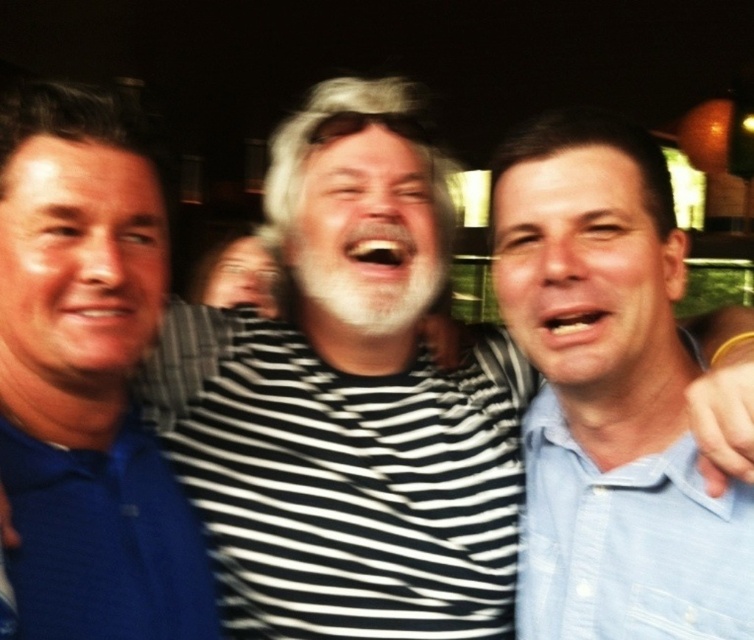
You are a photographer trying to adjust the lighting for a group photo. You notice two people wearing light blue shirts in the scene. The person in the light blue shirt at center is standing closer to the light source than the person in the light blue cotton shirt at right. Considering their shirt widths, which person might require more lighting adjustment to ensure their shirt doesn not appear too dark?

The light blue cotton shirt at right has a narrower width compared to the light blue shirt at center. Since the person in the light blue cotton shirt at right is farther from the light source and has a smaller shirt width, they might require more lighting adjustment to ensure their shirt doesn not appear too dark.

You are a photographer adjusting the focus on your camera. You need to focus on two points in the image labeled as point [543,401] and point [550,388]. Which point is closer to the camera and should be in focus first?

Point [543,401] is closer to the camera and should be focused first because it is further to the viewer than point [550,388].

You are taking a photo of two people wearing light blue shirts. The person in the light blue shirt at center is standing closer to you than the light blue cotton shirt at right. Which shirt is easier to see details on?

The light blue shirt at center is closer to the viewer than the light blue cotton shirt at right, so the light blue shirt at center is easier to see details on.